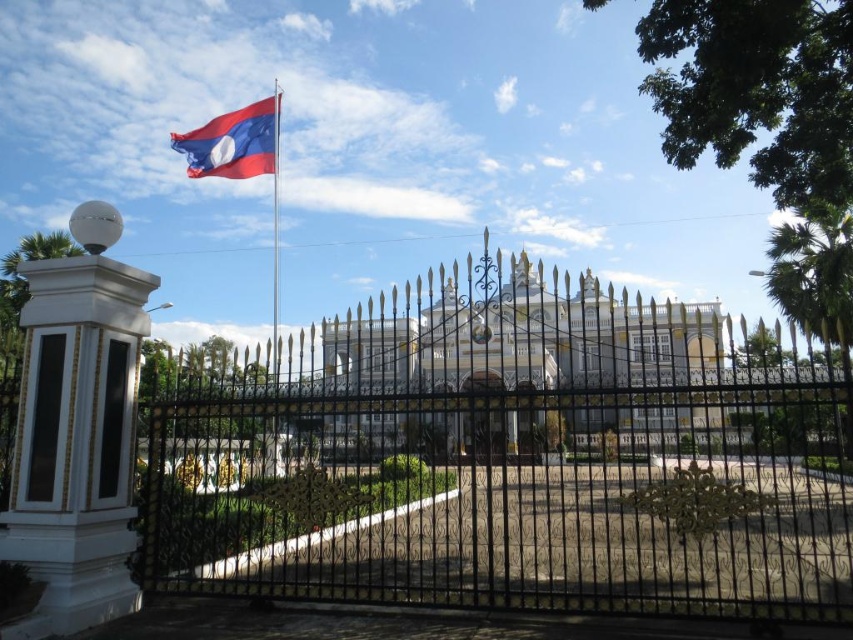
Question: Does black wrought iron fence at center have a larger size compared to red matte flag at upper left?

Choices:
 (A) no
 (B) yes

Answer: (B)

Question: Which point is farther to the camera?

Choices:
 (A) (41, 429)
 (B) (238, 492)

Answer: (B)

Question: Which point is closer to the camera?

Choices:
 (A) (154, 282)
 (B) (242, 147)
 (C) (352, 442)

Answer: (A)

Question: Which of the following is the farthest from the observer?

Choices:
 (A) white glossy palace at center
 (B) white glossy column at left
 (C) red matte flag at upper left
 (D) metallic flag pole at upper left

Answer: (C)

Question: Can you confirm if white glossy column at left is thinner than metallic flag pole at upper left?

Choices:
 (A) no
 (B) yes

Answer: (B)

Question: Does black wrought iron fence at center have a larger size compared to metallic flag pole at upper left?

Choices:
 (A) no
 (B) yes

Answer: (A)